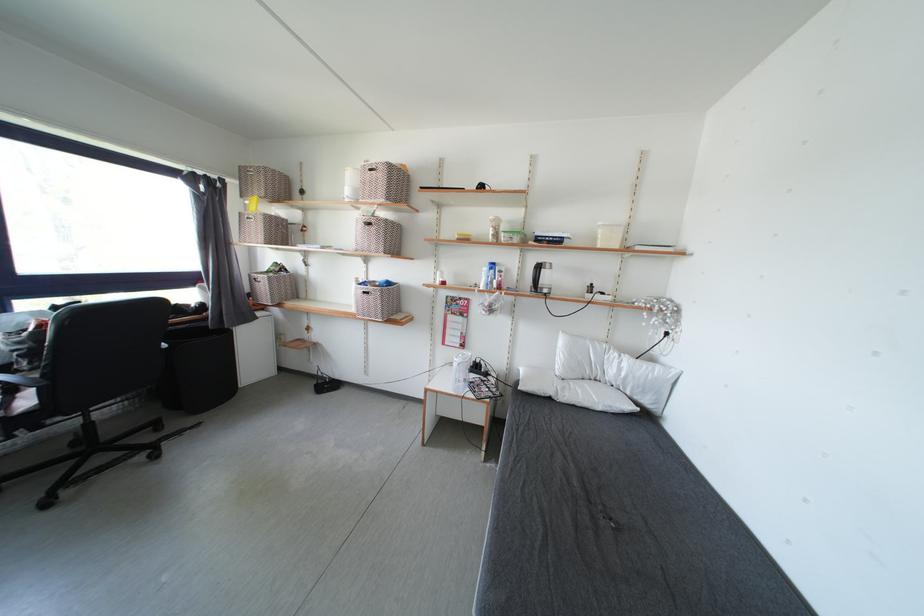
Describe the element at coordinates (551, 238) in the screenshot. I see `the plastic container lid` at that location.